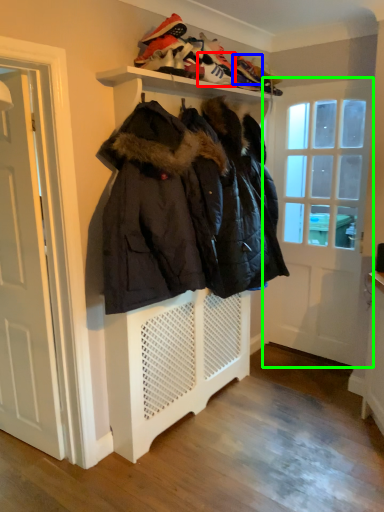
Question: Which is farther away from shoe (highlighted by a red box)? shoe (highlighted by a blue box) or door (highlighted by a green box)?

Choices:
 (A) shoe
 (B) door

Answer: (B)